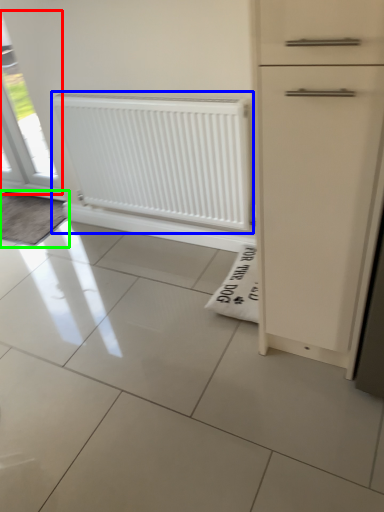
Question: Based on their relative distances, which object is nearer to window (highlighted by a red box)? Choose from radiator (highlighted by a blue box) and doormat (highlighted by a green box).

Choices:
 (A) radiator
 (B) doormat

Answer: (B)